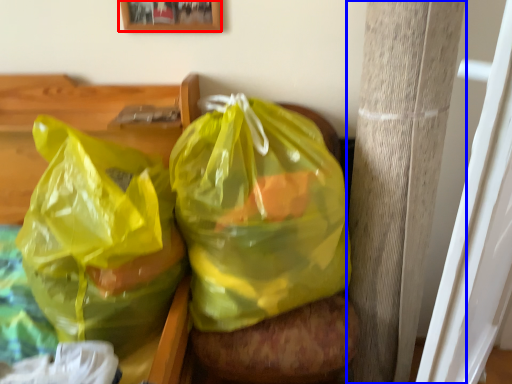
Question: Among these objects, which one is nearest to the camera, picture frame (highlighted by a red box) or pillar (highlighted by a blue box)?

Choices:
 (A) picture frame
 (B) pillar

Answer: (B)